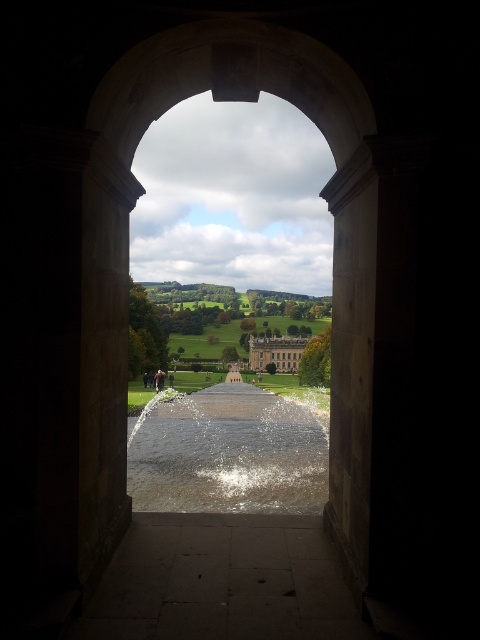
You are standing in front of the arched stone doorway and want to walk towards the grand building in the distance. According to the image, where exactly is the dark stone path at center located?

The dark stone path at center is located at point (x=222, y=580), so you should head towards that coordinate to reach the grand building in the distance.

You are standing in front of the arched stone doorway and want to walk towards the grand building. You have a small toy car that can move 1.2 meters per second. How long will it take for the toy car to reach the clear water at center from the dark stone path at center?

The dark stone path at center is 15.47 meters away from clear water at center. At a speed of 1.2 meters per second, the toy car will take 15.47 divided by 1.2, which is approximately 12.89 seconds to reach the clear water at center.

You are standing at the entrance of the arched stone doorway and notice a point marked at coordinates [222,580]. What object is located at that specific point?

The dark stone path at center is located at point [222,580].